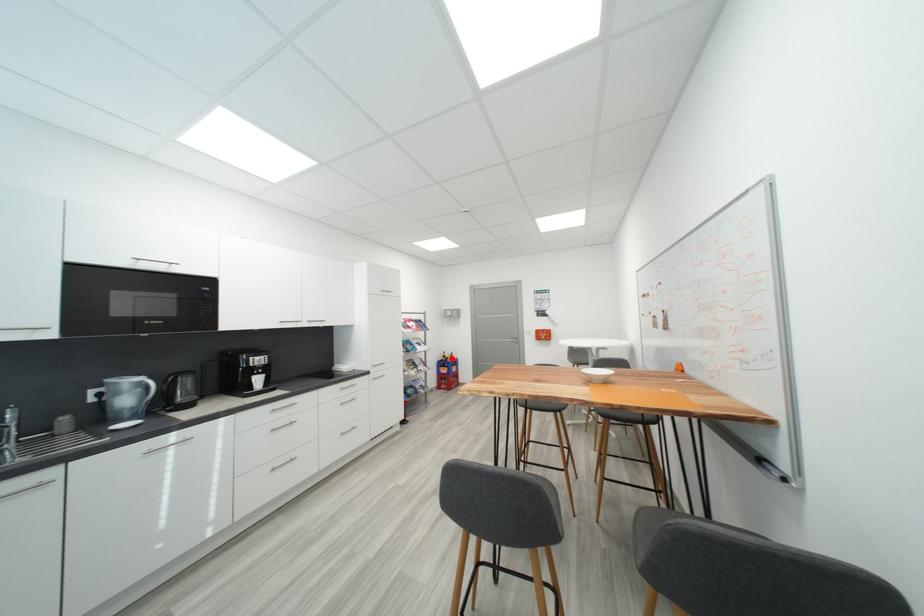
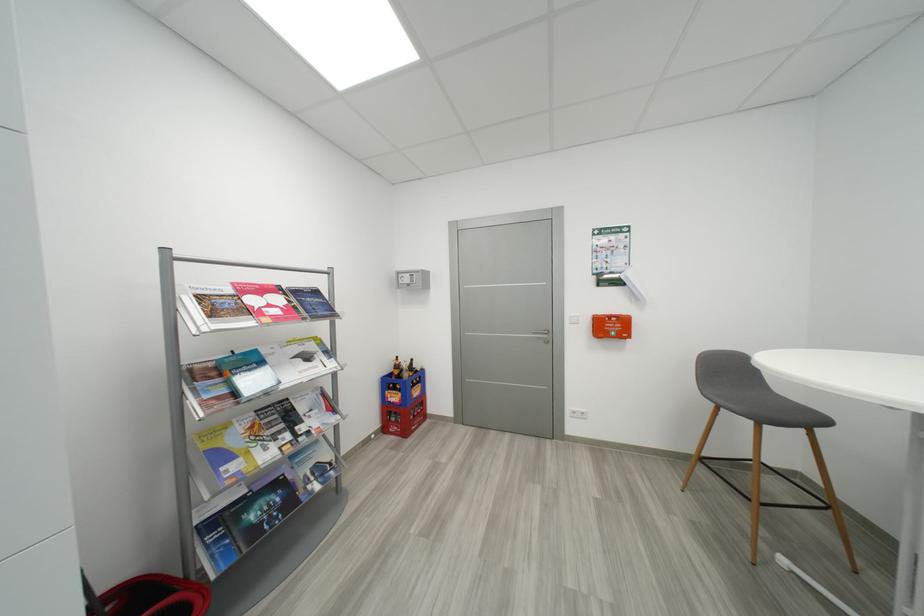
Where in the second image is the point corresponding to the highlighted location from the first image?

(404, 369)